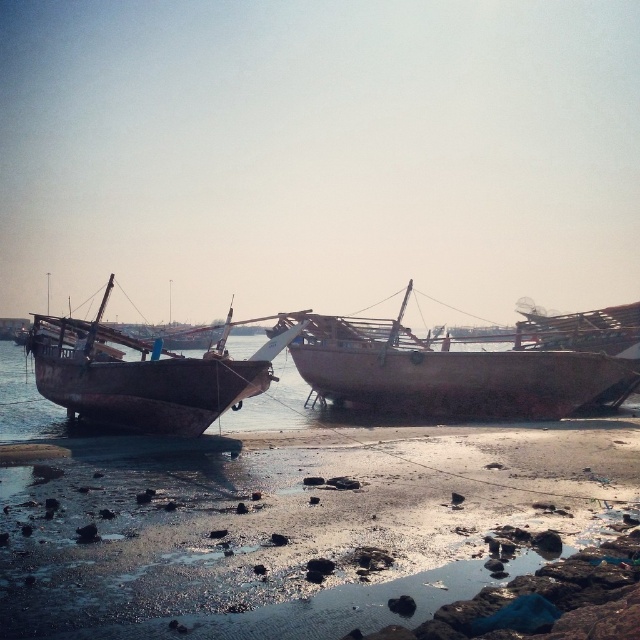
You are a photographer planning to capture the boats in the image. You want to ensure that both the rusty wood boat at center and the rusty wooden boat at left are visible in your shot. Considering their sizes, which boat should you position closer to the edge of the frame to avoid overcrowding?

The rusty wooden boat at left is shorter than the rusty wood boat at center. To avoid overcrowding, position the shorter rusty wooden boat at left closer to the edge of the frame since it takes up less space.

You are a delivery person who needs to transport a 4.5 meter long cargo container between the rusty wood boat at center and the rusty wooden boat at left. Is there enough space to maneuver the container between them?

The distance between the rusty wood boat at center and the rusty wooden boat at left is 4.65 meters. Since the cargo container is 4.5 meters long, there is sufficient space to maneuver it between the two boats.